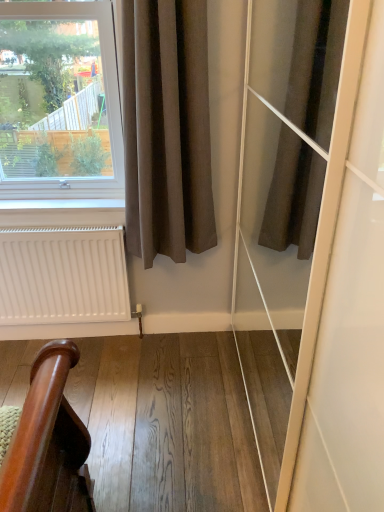
Locate an element on the screen. This screenshot has width=384, height=512. free space to the right of white matte radiator at lower left is located at coordinates (141, 361).